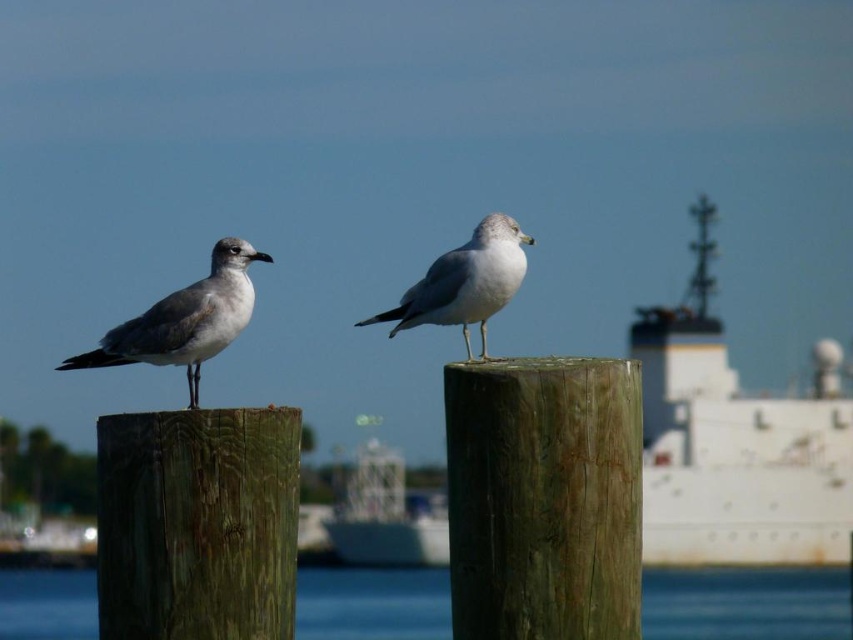
Question: Can you confirm if green weathered wood post at center is wider than brown wood post at left?

Choices:
 (A) no
 (B) yes

Answer: (A)

Question: Which of the following is the closest to the observer?

Choices:
 (A) (494, 212)
 (B) (593, 545)
 (C) (647, 449)

Answer: (B)

Question: Which of the following is the farthest from the observer?

Choices:
 (A) (596, 506)
 (B) (462, 301)

Answer: (B)

Question: Which point is closer to the camera?

Choices:
 (A) green weathered wood post at center
 (B) blue water at center
 (C) white matte ship at center
 (D) white matte seagull at center

Answer: (A)

Question: Is white matte ship at center positioned at the back of brown wood post at left?

Choices:
 (A) no
 (B) yes

Answer: (B)

Question: Can you confirm if green weathered wood post at center is bigger than white matte seagull at center?

Choices:
 (A) yes
 (B) no

Answer: (B)